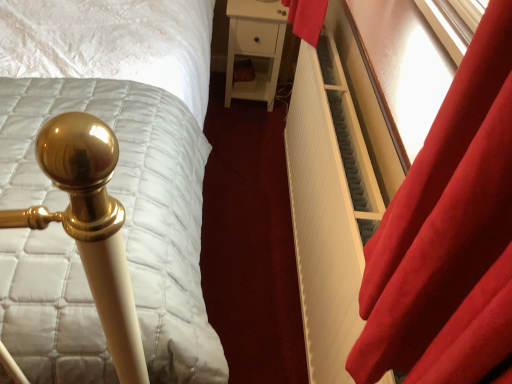
Question: Would you say gold metallic bedpost at left is outside velvet red curtain at right?

Choices:
 (A) yes
 (B) no

Answer: (A)

Question: Is gold metallic bedpost at left bigger than velvet red curtain at right?

Choices:
 (A) yes
 (B) no

Answer: (A)

Question: Is gold metallic bedpost at left next to velvet red curtain at right?

Choices:
 (A) no
 (B) yes

Answer: (A)

Question: Is velvet red curtain at right at the back of gold metallic bedpost at left?

Choices:
 (A) no
 (B) yes

Answer: (A)

Question: Is gold metallic bedpost at left at the left side of velvet red curtain at right?

Choices:
 (A) yes
 (B) no

Answer: (A)

Question: Can you confirm if gold metallic bedpost at left is thinner than velvet red curtain at right?

Choices:
 (A) yes
 (B) no

Answer: (B)

Question: Can you confirm if velvet red curtain at right is shorter than gold metallic bedpost at left?

Choices:
 (A) yes
 (B) no

Answer: (A)

Question: Would you consider velvet red curtain at right to be distant from gold metallic bedpost at left?

Choices:
 (A) yes
 (B) no

Answer: (B)

Question: Considering the relative sizes of velvet red curtain at right and gold metallic bedpost at left in the image provided, is velvet red curtain at right bigger than gold metallic bedpost at left?

Choices:
 (A) yes
 (B) no

Answer: (B)

Question: Considering the relative positions of velvet red curtain at right and gold metallic bedpost at left in the image provided, is velvet red curtain at right to the left of gold metallic bedpost at left from the viewer's perspective?

Choices:
 (A) yes
 (B) no

Answer: (B)

Question: Is velvet red curtain at right at the right side of gold metallic bedpost at left?

Choices:
 (A) yes
 (B) no

Answer: (A)

Question: Is velvet red curtain at right positioned with its back to gold metallic bedpost at left?

Choices:
 (A) yes
 (B) no

Answer: (B)

Question: Is the position of velvet red curtain at right less distant than that of white ribbed radiator at right?

Choices:
 (A) no
 (B) yes

Answer: (B)